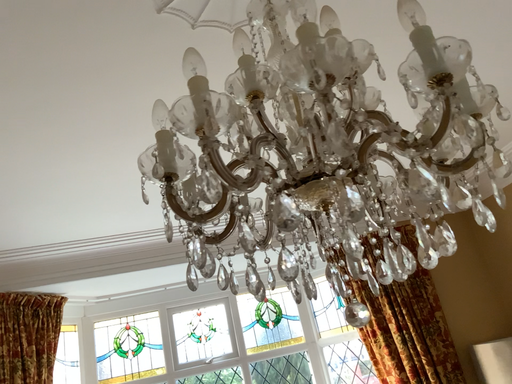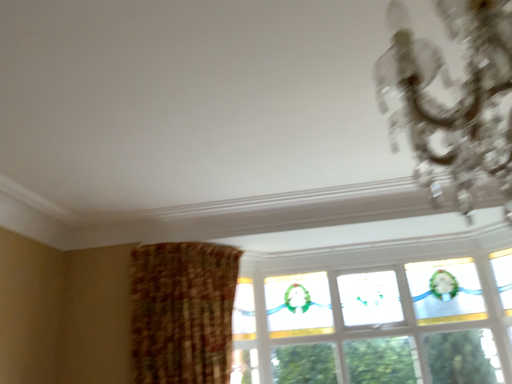
Question: How did the camera likely rotate when shooting the video?

Choices:
 (A) rotated left
 (B) rotated right

Answer: (A)